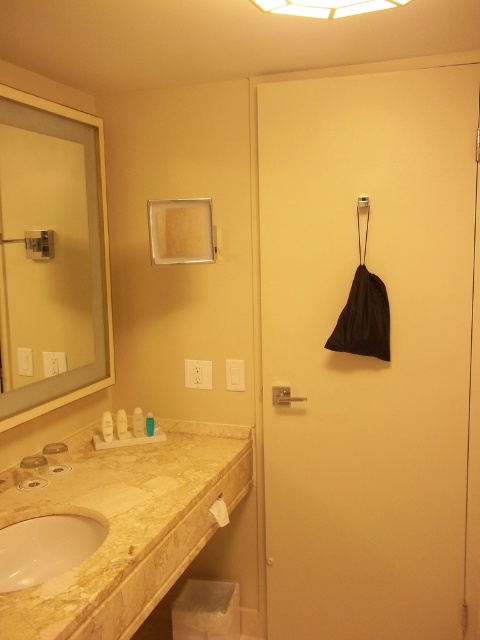
Between black fabric bag at right and translucent plastic bottle at lower left, which one appears on the right side from the viewer's perspective?

black fabric bag at right

Which is in front, point (289, 192) or point (142, 435)?

Positioned in front is point (289, 192).

Is point (444, 317) behind point (140, 432)?

No, it is in front of (140, 432).

You are a GUI agent. You are given a task and a screenshot of the screen. Output one action in this format:
    pyautogui.click(x=<x>, y=<y>)
    Task: Click on the black fabric bag at right
    
    Given the screenshot: What is the action you would take?
    pyautogui.click(x=363, y=356)

Between point (468, 68) and point (147, 428), which one is positioned in front?

Point (468, 68) is in front.

Which is below, black fabric bag at right or white plastic bottles at lower left?

white plastic bottles at lower left is below.

Is point (285, 632) positioned behind point (148, 429)?

Yes.

I want to click on black fabric bag at right, so click(x=363, y=356).

Who is more forward, (462,189) or (101,419)?

Positioned in front is point (462,189).

Is point (308, 577) less distant than point (104, 433)?

No, (308, 577) is behind (104, 433).

Identify the location of black fabric bag at right. 363,356.